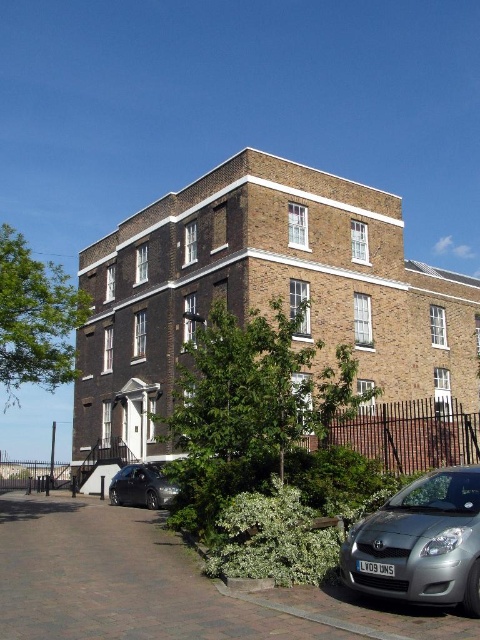
You are a delivery person trying to park a 4.5 meter long truck in the space between the satin silver car at lower right and the shiny black sedan at lower left. Can the truck fit in that space?

The satin silver car at lower right is shorter than the shiny black sedan at lower left, but the description does not provide the exact length of the space between them. Therefore, it is unclear if the 4.5 meter long truck can fit in that space.

You are standing at the front of the three story brick building and want to walk to the garden area. There are two points marked on the ground, point 1 at coordinates point (349,532) and point 2 at coordinates point (144,467). Which point is closer to the garden area?

Point (349,532) is in front of point (144,467), so point (349,532) is closer to the garden area.